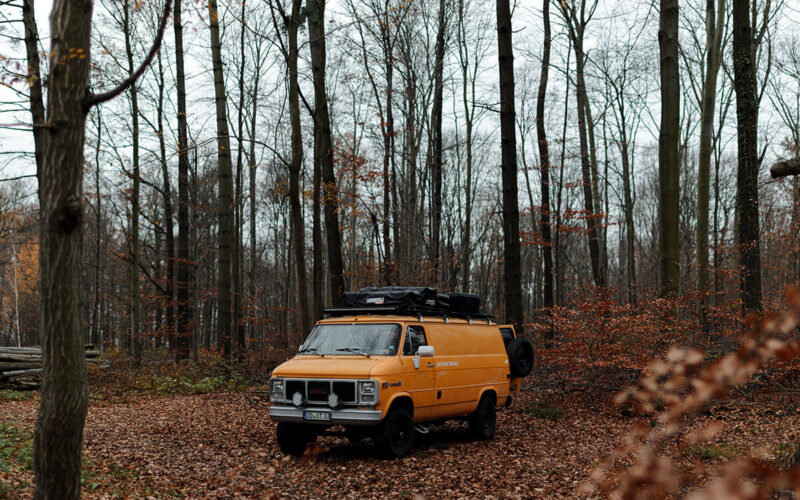
At what (x,y) coordinates should I click in order to perform the action: click on mirror. Please return your answer as a coordinate pair (x, y). Looking at the image, I should click on (428, 352).